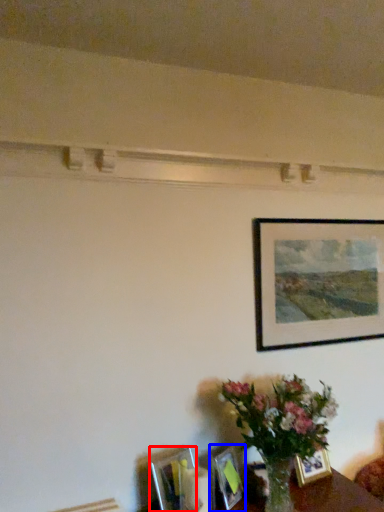
Question: Which of the following is the farthest to the observer, picture frame (highlighted by a red box) or picture frame (highlighted by a blue box)?

Choices:
 (A) picture frame
 (B) picture frame

Answer: (B)